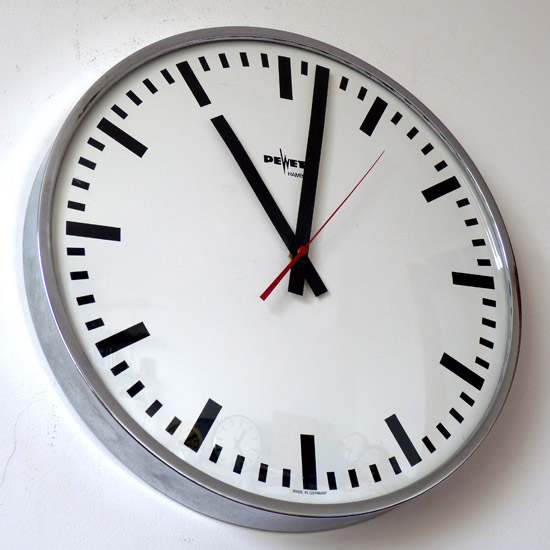
Find the location of a particular element. wall is located at coordinates (508, 42).